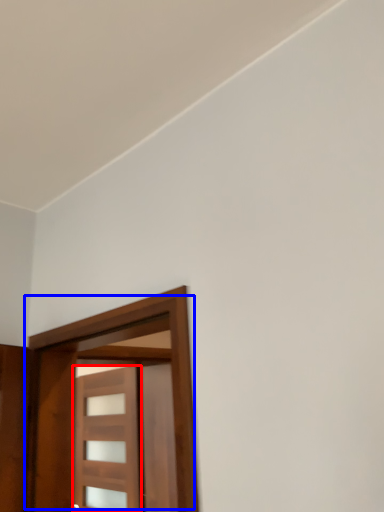
Question: Which object is closer to the camera taking this photo, door (highlighted by a red box) or door (highlighted by a blue box)?

Choices:
 (A) door
 (B) door

Answer: (B)